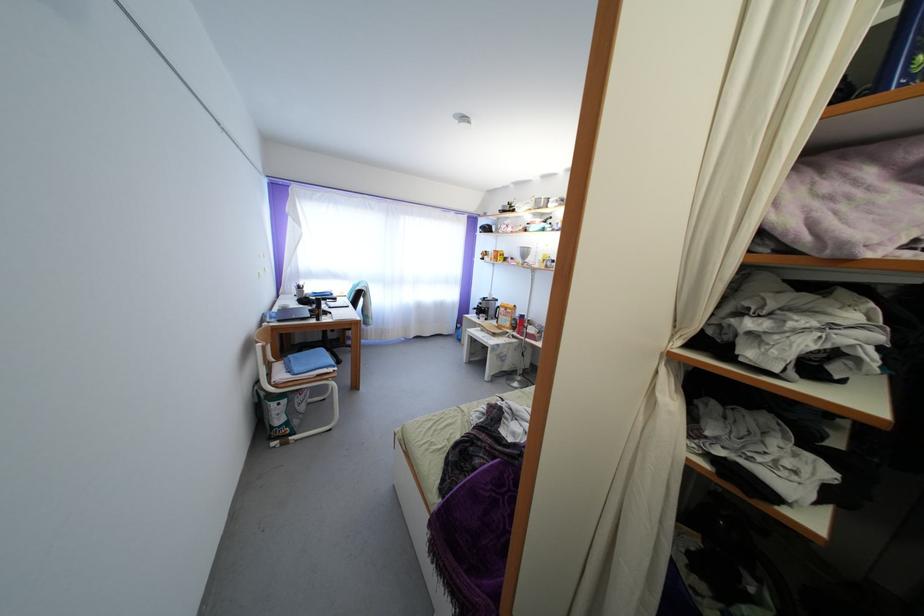
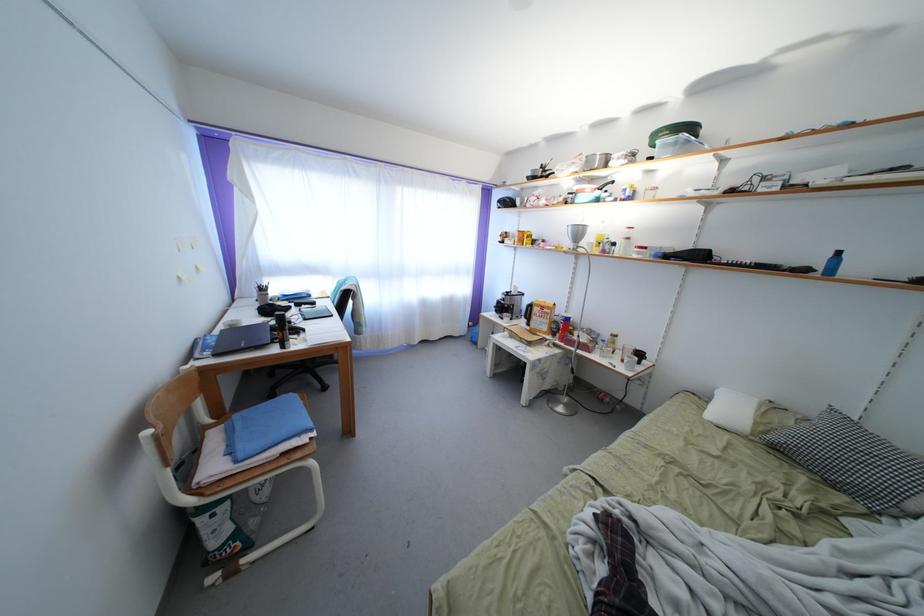
Locate, in the second image, the point that corresponds to point (301, 378) in the first image.

(247, 463)